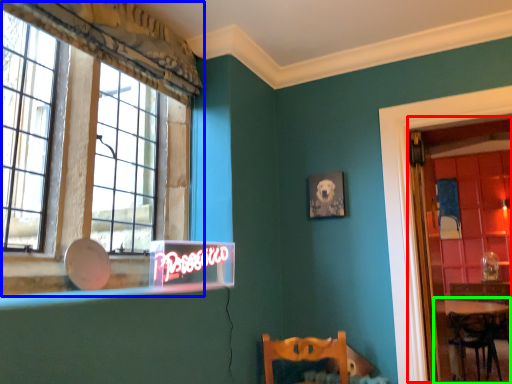
Question: Which is nearer to the glass door (highlighted by a red box)? window (highlighted by a blue box) or table (highlighted by a green box).

Choices:
 (A) window
 (B) table

Answer: (B)